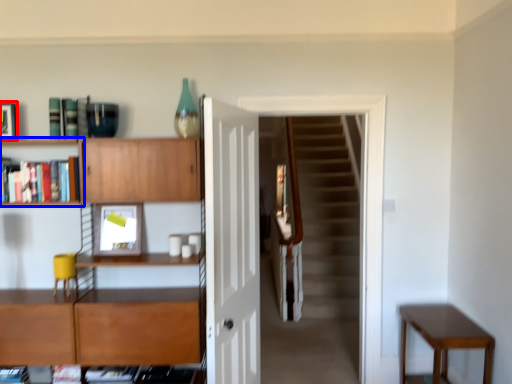
Question: Which of the following is the farthest to the observer, picture frame (highlighted by a red box) or shelf (highlighted by a blue box)?

Choices:
 (A) picture frame
 (B) shelf

Answer: (A)